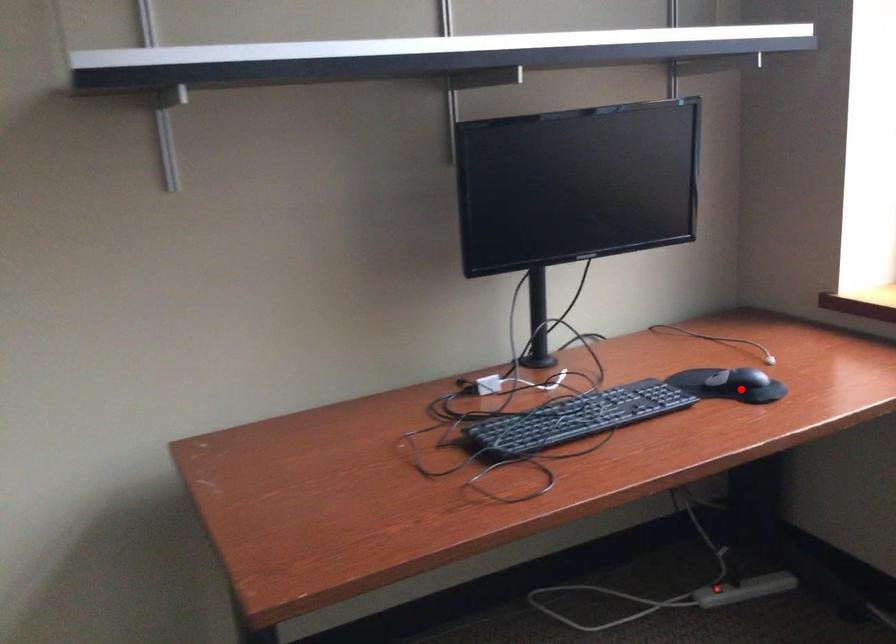
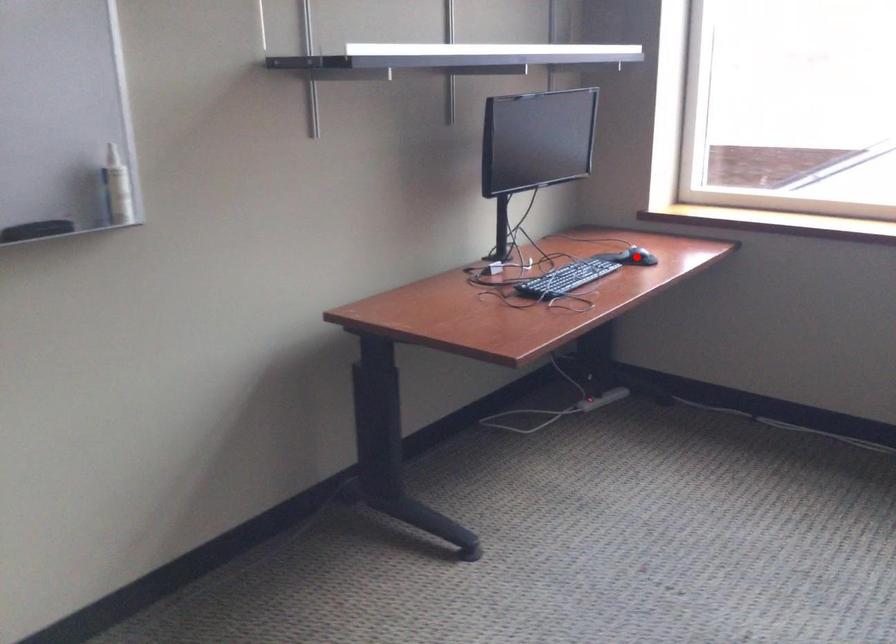
I am providing you with two images of the same scene from different viewpoints. A red point is marked on the first image and another point is marked on the second image. Is the red point in image1 aligned with the point shown in image2?

Yes